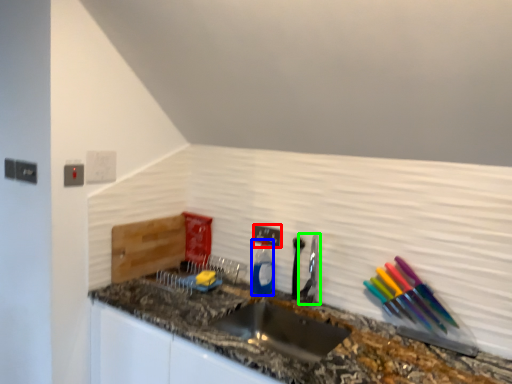
Question: Which object is the farthest from electric outlet (highlighted by a red box)? Choose among these: bottle (highlighted by a blue box) or faucet (highlighted by a green box).

Choices:
 (A) bottle
 (B) faucet

Answer: (B)